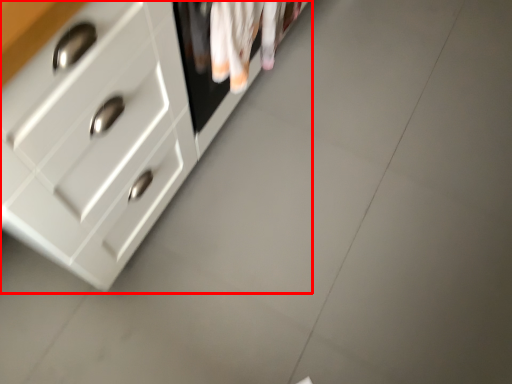
Question: From the image's perspective, what is the correct spatial positioning of chest of drawers (annotated by the red box) in reference to laundry?

Choices:
 (A) above
 (B) below

Answer: (A)